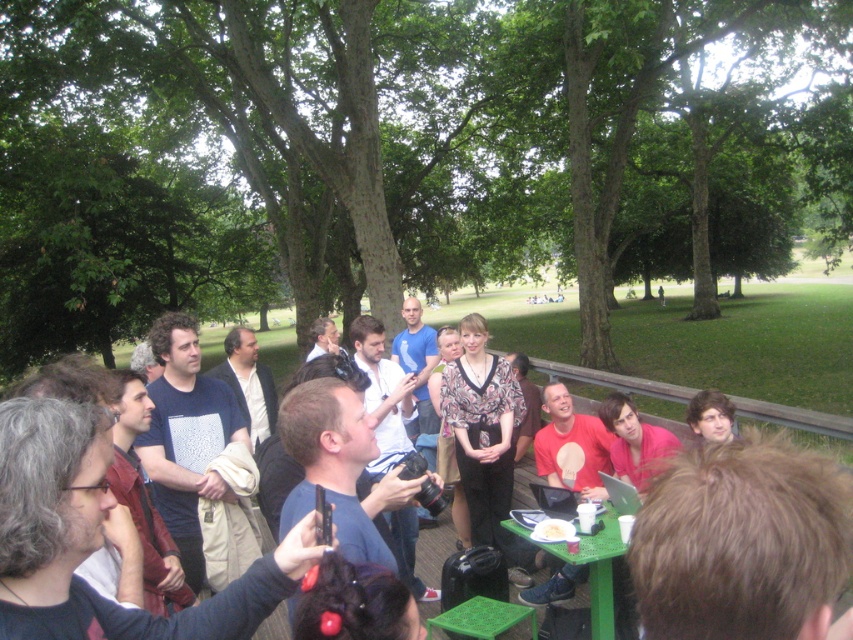
Consider the image. How far apart are green plastic table at center and white paper plate at center?

green plastic table at center and white paper plate at center are 6.49 inches apart.

Which is more to the right, green plastic table at center or white paper plate at center?

Positioned to the right is green plastic table at center.

Does point (599, 550) come closer to viewer compared to point (532, 532)?

That is True.

At what (x,y) coordinates should I click in order to perform the action: click on green plastic table at center. Please return your answer as a coordinate pair (x, y). The width and height of the screenshot is (853, 640). Looking at the image, I should click on (590, 566).